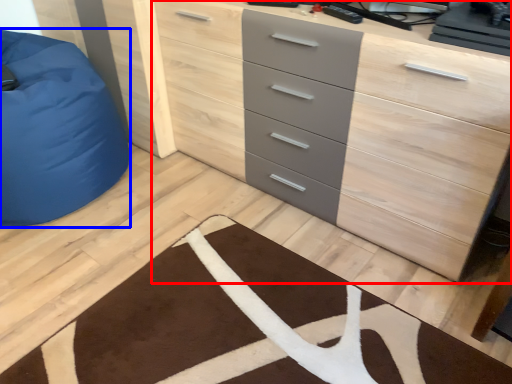
Question: Which object is further to the camera taking this photo, chest of drawers (highlighted by a red box) or furniture (highlighted by a blue box)?

Choices:
 (A) chest of drawers
 (B) furniture

Answer: (B)